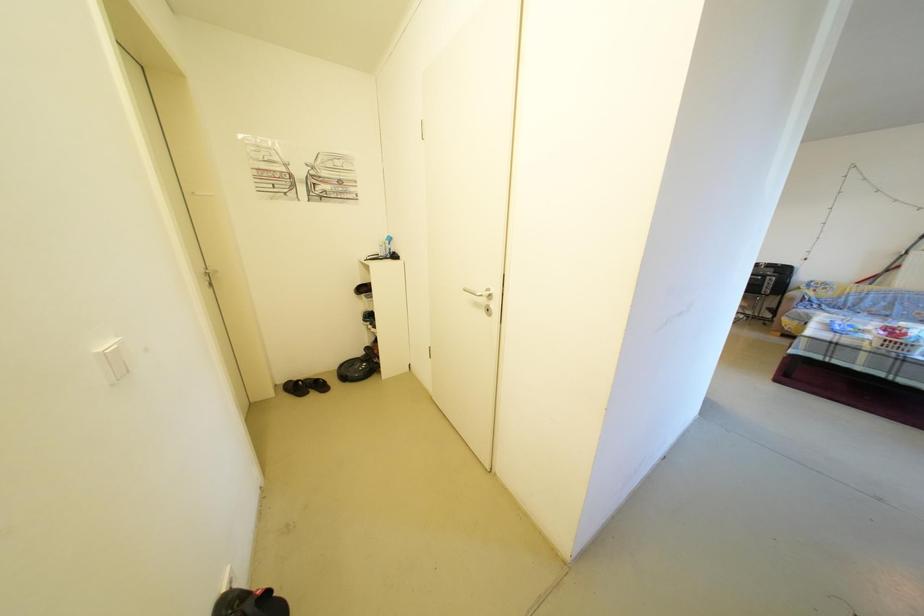
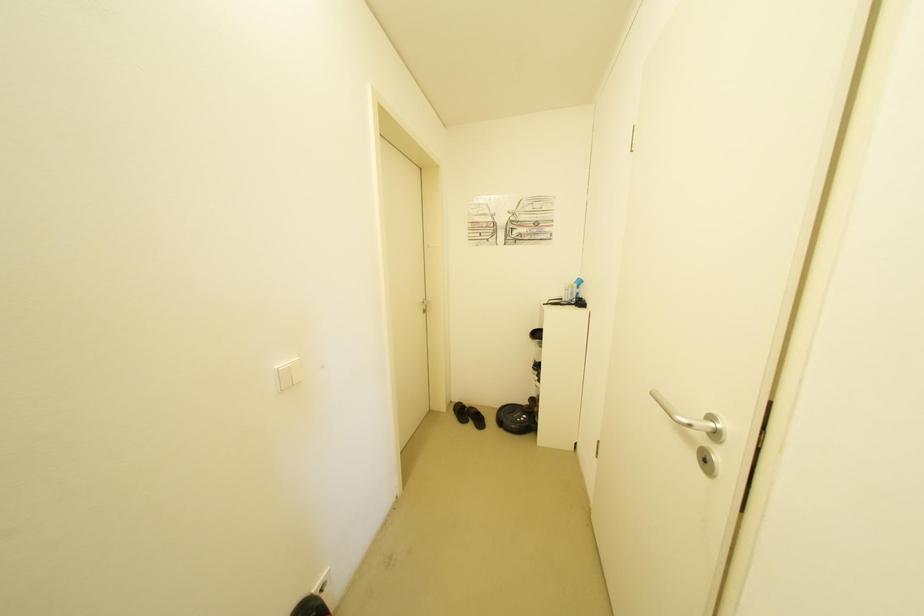
Question: Based on the continuous images, in which direction is the camera rotating? Reply with the corresponding letter.

Choices:
 (A) Left
 (B) Right
 (C) Up
 (D) Down

Answer: (A)